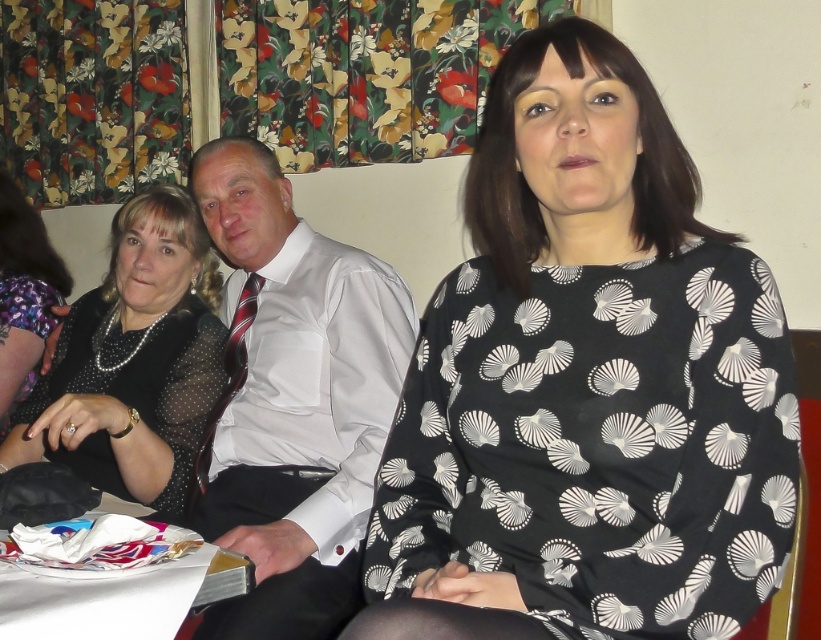
Question: Does black printed blouse at center have a greater width compared to white satin shirt at center?

Choices:
 (A) no
 (B) yes

Answer: (B)

Question: Which point appears closest to the camera in this image?

Choices:
 (A) (168, 202)
 (B) (290, 429)
 (C) (565, 49)

Answer: (C)

Question: Does black printed blouse at center appear on the right side of white satin shirt at center?

Choices:
 (A) no
 (B) yes

Answer: (B)

Question: Which of the following is the farthest from the observer?

Choices:
 (A) white satin shirt at center
 (B) black printed blouse at center
 (C) black sheer dress at left

Answer: (C)

Question: Which point is closer to the camera taking this photo?

Choices:
 (A) (135, 323)
 (B) (606, 465)

Answer: (B)

Question: Can you confirm if black printed blouse at center is wider than black sheer dress at left?

Choices:
 (A) yes
 (B) no

Answer: (B)